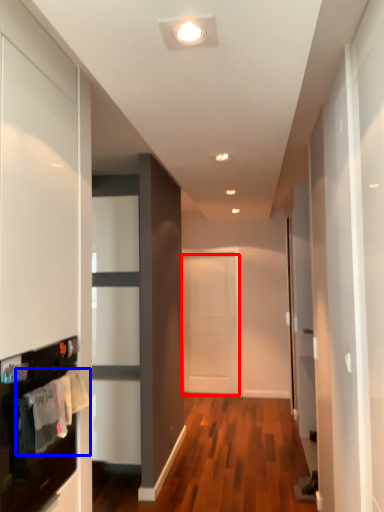
Question: Which of the following is the closest to the observer, door (highlighted by a red box) or laundry (highlighted by a blue box)?

Choices:
 (A) door
 (B) laundry

Answer: (B)